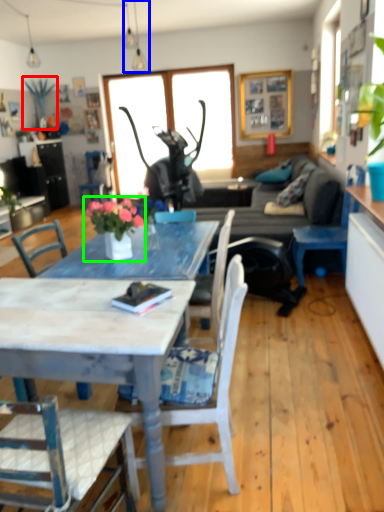
Question: Considering the real-world distances, which object is farthest from plant (highlighted by a red box)? lamp (highlighted by a blue box) or houseplant (highlighted by a green box)?

Choices:
 (A) lamp
 (B) houseplant

Answer: (B)